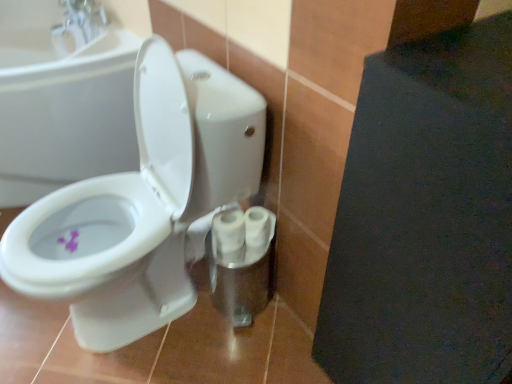
Locate an element on the screen. Image resolution: width=512 pixels, height=384 pixels. white matte toilet paper at lower center, the first toilet paper positioned from the right is located at coordinates (258, 227).

The image size is (512, 384). What do you see at coordinates (58, 37) in the screenshot?
I see `white glossy sink at upper left` at bounding box center [58, 37].

What do you see at coordinates (64, 112) in the screenshot? This screenshot has width=512, height=384. I see `white glossy toilet at center left` at bounding box center [64, 112].

What is the approximate width of white glossy toilet at center left?

white glossy toilet at center left is 27.56 inches wide.

Where is `white glossy toilet paper at center, which is the 1th toilet paper in left-to-right order`? white glossy toilet paper at center, which is the 1th toilet paper in left-to-right order is located at coordinates (228, 231).

Is white glossy toilet paper at center, which is the 1th toilet paper in left-to-right order, located outside white glossy toilet at center?

That's incorrect, white glossy toilet paper at center, which is the 1th toilet paper in left-to-right order, is not completely outside white glossy toilet at center.

From the image's perspective, is white glossy toilet paper at center, acting as the 2th toilet paper starting from the right, located above white glossy toilet at center?

No, from the image's perspective, white glossy toilet paper at center, acting as the 2th toilet paper starting from the right, is not over white glossy toilet at center.

Based on the photo, which object is closer to the camera, white glossy toilet paper at center, acting as the 2th toilet paper starting from the right, or white glossy toilet at center?

white glossy toilet at center is closer to the camera.

Is white glossy toilet paper at center, acting as the 2th toilet paper starting from the right, thinner than white glossy toilet at center?

Yes, white glossy toilet paper at center, acting as the 2th toilet paper starting from the right, is thinner than white glossy toilet at center.

Looking at this image, does white glossy sink at upper left turn towards white glossy toilet paper at center, which is the 1th toilet paper in left-to-right order?

No, white glossy sink at upper left is not turned towards white glossy toilet paper at center, which is the 1th toilet paper in left-to-right order.

Is white glossy sink at upper left completely or partially outside of white glossy toilet paper at center, acting as the 2th toilet paper starting from the right?

Yes, white glossy sink at upper left is not within white glossy toilet paper at center, acting as the 2th toilet paper starting from the right.

Is white glossy sink at upper left far away from white glossy toilet paper at center, acting as the 2th toilet paper starting from the right?

No, there isn't a large distance between white glossy sink at upper left and white glossy toilet paper at center, acting as the 2th toilet paper starting from the right.

Looking at this image, is white glossy toilet at center taller than white glossy sink at upper left?

Correct, white glossy toilet at center is much taller as white glossy sink at upper left.

From the image's perspective, would you say white glossy toilet at center is positioned over white glossy sink at upper left?

No, from the image's perspective, white glossy toilet at center is not above white glossy sink at upper left.

Is point (77, 299) behind point (116, 34)?

No, (77, 299) is closer to viewer.

Looking at their sizes, would you say purple matte flower at lower left is wider or thinner than white glossy toilet at center?

Clearly, purple matte flower at lower left has less width compared to white glossy toilet at center.

How different are the orientations of purple matte flower at lower left and white glossy toilet at center in degrees?

The angular difference between purple matte flower at lower left and white glossy toilet at center is 82.3 degrees.

Is purple matte flower at lower left bigger than white glossy toilet at center?

No, purple matte flower at lower left is not bigger than white glossy toilet at center.

Which is more to the right, white glossy toilet at center left or white matte toilet paper at lower center, the first toilet paper positioned from the right?

From the viewer's perspective, white matte toilet paper at lower center, the first toilet paper positioned from the right, appears more on the right side.

Considering the points (37, 165) and (269, 241), which point is in front, point (37, 165) or point (269, 241)?

The point (269, 241) is more forward.

Could you tell me if white glossy toilet at center left is turned towards white matte toilet paper at lower center, the second toilet paper positioned from the left?

No, white glossy toilet at center left is not turned towards white matte toilet paper at lower center, the second toilet paper positioned from the left.

Is white glossy toilet at center left next to white matte toilet paper at lower center, the first toilet paper positioned from the right, and touching it?

There is a gap between white glossy toilet at center left and white matte toilet paper at lower center, the first toilet paper positioned from the right.

Considering the points (73, 241) and (239, 242), which point is behind, point (73, 241) or point (239, 242)?

The point (73, 241) is behind.

This screenshot has width=512, height=384. Identify the location of flower to the left of white glossy toilet paper at center, acting as the 2th toilet paper starting from the right. (70, 241).

Considering the relative sizes of purple matte flower at lower left and white glossy toilet paper at center, acting as the 2th toilet paper starting from the right, in the image provided, is purple matte flower at lower left thinner than white glossy toilet paper at center, acting as the 2th toilet paper starting from the right,?

Yes, purple matte flower at lower left is thinner than white glossy toilet paper at center, acting as the 2th toilet paper starting from the right.

Measure the distance between white glossy toilet at center and purple matte flower at lower left.

A distance of 14.09 inches exists between white glossy toilet at center and purple matte flower at lower left.

Would you say white glossy toilet at center is to the left or to the right of purple matte flower at lower left in the picture?

Based on their positions, white glossy toilet at center is located to the right of purple matte flower at lower left.

Consider the image. Is there a large distance between white glossy toilet at center and purple matte flower at lower left?

No, white glossy toilet at center is not far from purple matte flower at lower left.

Is point (88, 226) closer or farther from the camera than point (57, 240)?

Point (88, 226) is positioned farther from the camera compared to point (57, 240).

The image size is (512, 384). I want to click on toilet lying in front of the white glossy toilet paper at center, which is the 1th toilet paper in left-to-right order, so click(143, 203).

The width and height of the screenshot is (512, 384). I want to click on the 2nd toilet paper below the white glossy sink at upper left (from the image's perspective), so click(228, 231).

Looking at the image, which one is located closer to white glossy toilet at center, white glossy sink at upper left or white glossy toilet paper at center, which is the 1th toilet paper in left-to-right order?

white glossy toilet paper at center, which is the 1th toilet paper in left-to-right order, is closer to white glossy toilet at center.

Estimate the real-world distances between objects in this image. Which object is closer to white glossy toilet at center, white matte toilet paper at lower center, the first toilet paper positioned from the right, or white glossy toilet paper at center, acting as the 2th toilet paper starting from the right?

white glossy toilet paper at center, acting as the 2th toilet paper starting from the right, is closer to white glossy toilet at center.

Estimate the real-world distances between objects in this image. Which object is further from white glossy toilet at center left, white glossy toilet paper at center, acting as the 2th toilet paper starting from the right, or white matte toilet paper at lower center, the first toilet paper positioned from the right?

white matte toilet paper at lower center, the first toilet paper positioned from the right, is positioned further to the anchor white glossy toilet at center left.

Estimate the real-world distances between objects in this image. Which object is further from white glossy toilet paper at center, which is the 1th toilet paper in left-to-right order, white glossy toilet at center or purple matte flower at lower left?

purple matte flower at lower left.

Which object lies nearer to the anchor point white glossy toilet at center, purple matte flower at lower left or white glossy sink at upper left?

purple matte flower at lower left.

Based on the photo, looking at the image, which one is located further to white glossy toilet at center left, white glossy sink at upper left or white matte toilet paper at lower center, the second toilet paper positioned from the left?

white matte toilet paper at lower center, the second toilet paper positioned from the left, is further to white glossy toilet at center left.

From the image, which object appears to be farther from purple matte flower at lower left, white glossy toilet at center left or white glossy sink at upper left?

The object further to purple matte flower at lower left is white glossy sink at upper left.

From the image, which object appears to be farther from white glossy toilet paper at center, which is the 1th toilet paper in left-to-right order, white glossy toilet at center left or white glossy sink at upper left?

Among the two, white glossy sink at upper left is located further to white glossy toilet paper at center, which is the 1th toilet paper in left-to-right order.

The image size is (512, 384). Find the location of `toilet between white glossy toilet at center left and purple matte flower at lower left from top to bottom`. toilet between white glossy toilet at center left and purple matte flower at lower left from top to bottom is located at coordinates (143, 203).

Find the location of a particular element. This screenshot has height=384, width=512. sink located between white glossy toilet at center left and white matte toilet paper at lower center, the first toilet paper positioned from the right, in the left-right direction is located at coordinates (x=58, y=37).

At what (x,y) coordinates should I click in order to perform the action: click on toilet located between white glossy toilet at center left and white glossy toilet paper at center, acting as the 2th toilet paper starting from the right, in the left-right direction. Please return your answer as a coordinate pair (x, y). This screenshot has width=512, height=384. Looking at the image, I should click on (143, 203).

Image resolution: width=512 pixels, height=384 pixels. Find the location of `bath between white glossy sink at upper left and purple matte flower at lower left vertically`. bath between white glossy sink at upper left and purple matte flower at lower left vertically is located at coordinates (64, 112).